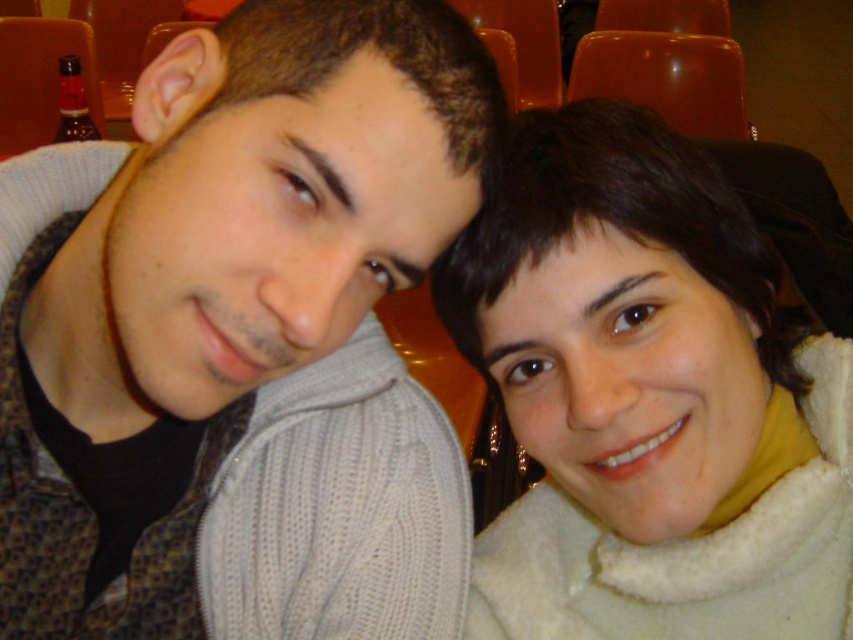
Question: Which point is farther from the camera taking this photo?

Choices:
 (A) click(364, 627)
 (B) click(788, 568)

Answer: (A)

Question: Does knitted sweater at center appear on the right side of white fleece scarf at upper right?

Choices:
 (A) yes
 (B) no

Answer: (B)

Question: Does knitted sweater at center lie behind white fleece scarf at upper right?

Choices:
 (A) no
 (B) yes

Answer: (A)

Question: Is knitted sweater at center above white fleece scarf at upper right?

Choices:
 (A) yes
 (B) no

Answer: (A)

Question: Among these points, which one is nearest to the camera?

Choices:
 (A) (616, 145)
 (B) (265, 342)

Answer: (B)

Question: Which object is closer to the camera taking this photo?

Choices:
 (A) white fleece scarf at upper right
 (B) knitted sweater at center

Answer: (B)